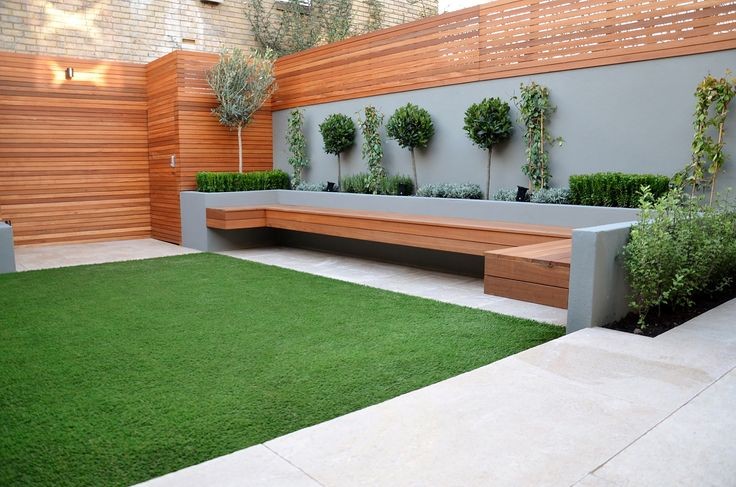
This screenshot has width=736, height=487. Identify the location of top of bench seating. (534, 252).